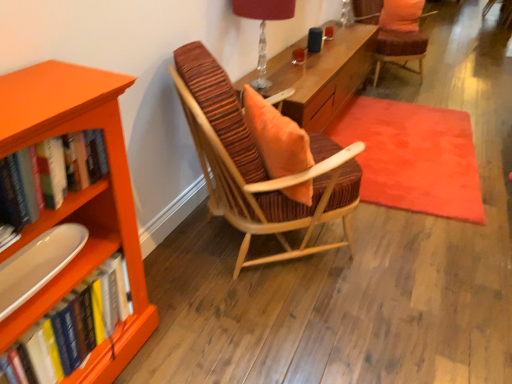
What is the approximate width of velvet orange cushioned chair at upper right, the second chair viewed from the front?

It is 31.78 inches.

What do you see at coordinates (395, 31) in the screenshot? The image size is (512, 384). I see `velvet orange cushioned chair at upper right, the second chair viewed from the front` at bounding box center [395, 31].

Identify the location of hardcover books at left, positioned as the 1th book in top-to-bottom order. The image size is (512, 384). (51, 173).

At what (x,y) coordinates should I click in order to perform the action: click on striped fabric chair at center, the 2th chair viewed from the back. Please return your answer as a coordinate pair (x, y). Looking at the image, I should click on (259, 164).

Describe the element at coordinates (81, 322) in the screenshot. This screenshot has height=384, width=512. I see `hardcover books at left, acting as the 1th book starting from the bottom` at that location.

Locate an element on the screen. translucent glass table lamp at upper center is located at coordinates (263, 27).

I want to click on velvet orange cushioned chair at upper right, arranged as the first chair when viewed from the back, so click(x=395, y=31).

Would you say striped fabric chair at center, which is the second chair in right-to-left order, is outside velvet orange cushioned chair at upper right, acting as the first chair starting from the right?

Indeed, striped fabric chair at center, which is the second chair in right-to-left order, is completely outside velvet orange cushioned chair at upper right, acting as the first chair starting from the right.

Considering the relative sizes of striped fabric chair at center, the first chair from the left, and velvet orange cushioned chair at upper right, arranged as the first chair when viewed from the back, in the image provided, is striped fabric chair at center, the first chair from the left, wider than velvet orange cushioned chair at upper right, arranged as the first chair when viewed from the back,?

Incorrect, the width of striped fabric chair at center, the first chair from the left, does not surpass that of velvet orange cushioned chair at upper right, arranged as the first chair when viewed from the back.

Considering the relative positions of striped fabric chair at center, the 1th chair positioned from the bottom, and velvet orange cushioned chair at upper right, acting as the first chair starting from the right, in the image provided, is striped fabric chair at center, the 1th chair positioned from the bottom, to the left of velvet orange cushioned chair at upper right, acting as the first chair starting from the right, from the viewer's perspective?

Yes.

From a real-world perspective, which object stands above the other?

striped fabric chair at center, the 1th chair positioned from the bottom, is physically above.

Which object is further away from the camera taking this photo, velvet orange rug at center or orange fabric pillow at upper right?

Positioned behind is orange fabric pillow at upper right.

Is velvet orange rug at center oriented towards orange fabric pillow at upper right?

No, velvet orange rug at center is not facing towards orange fabric pillow at upper right.

Does velvet orange rug at center appear on the left side of orange fabric pillow at upper right?

Yes, velvet orange rug at center is to the left of orange fabric pillow at upper right.

Identify the location of the 1st chair behind the hardcover books at left, the second book in the bottom-to-top sequence. (259, 164).

Considering the relative sizes of hardcover books at left, positioned as the 1th book in top-to-bottom order, and striped fabric chair at center, the first chair from the left, in the image provided, is hardcover books at left, positioned as the 1th book in top-to-bottom order, bigger than striped fabric chair at center, the first chair from the left,?

No.

Is hardcover books at left, positioned as the 1th book in top-to-bottom order, not close to striped fabric chair at center, the 1th chair positioned from the bottom?

That's not correct — hardcover books at left, positioned as the 1th book in top-to-bottom order, is a little close to striped fabric chair at center, the 1th chair positioned from the bottom.

Considering the relative positions of hardcover books at left, positioned as the 1th book in top-to-bottom order, and striped fabric chair at center, which appears as the 2th chair when viewed from the top, in the image provided, is hardcover books at left, positioned as the 1th book in top-to-bottom order, to the left of striped fabric chair at center, which appears as the 2th chair when viewed from the top, from the viewer's perspective?

Indeed, hardcover books at left, positioned as the 1th book in top-to-bottom order, is positioned on the left side of striped fabric chair at center, which appears as the 2th chair when viewed from the top.

Is matte white tray at lower left at the right side of orange fabric pillow at upper right?

No, matte white tray at lower left is not to the right of orange fabric pillow at upper right.

At what (x,y) coordinates should I click in order to perform the action: click on pillow behind the matte white tray at lower left. Please return your answer as a coordinate pair (x, y). Looking at the image, I should click on (401, 15).

Is matte white tray at lower left positioned in front of orange fabric pillow at upper right?

Yes, it is.

Is translucent glass table lamp at upper center to the right of hardcover books at left, acting as the 1th book starting from the bottom, from the viewer's perspective?

Indeed, translucent glass table lamp at upper center is positioned on the right side of hardcover books at left, acting as the 1th book starting from the bottom.

Does translucent glass table lamp at upper center turn towards hardcover books at left, which ranks as the 2th book in top-to-bottom order?

No, translucent glass table lamp at upper center is not aimed at hardcover books at left, which ranks as the 2th book in top-to-bottom order.

Which object is closer to the camera taking this photo, translucent glass table lamp at upper center or hardcover books at left, acting as the 1th book starting from the bottom?

hardcover books at left, acting as the 1th book starting from the bottom, is in front.

Is translucent glass table lamp at upper center not near hardcover books at left, acting as the 1th book starting from the bottom?

Yes.

How distant is striped fabric chair at center, the 1th chair positioned from the bottom, from orange matte bookcase at left?

striped fabric chair at center, the 1th chair positioned from the bottom, and orange matte bookcase at left are 21.52 inches apart.

Would you say striped fabric chair at center, which is the second chair in right-to-left order, is outside orange matte bookcase at left?

striped fabric chair at center, which is the second chair in right-to-left order, lies outside orange matte bookcase at left's area.

From a real-world perspective, is striped fabric chair at center, the 2th chair viewed from the back, physically located above or below orange matte bookcase at left?

striped fabric chair at center, the 2th chair viewed from the back, is situated higher than orange matte bookcase at left in the real world.

Does point (241, 191) come in front of point (99, 91)?

No, it is behind (99, 91).

Is orange matte bookcase at left at the back of velvet orange rug at center?

No, velvet orange rug at center is not facing the opposite direction of orange matte bookcase at left.

Considering the points (444, 201) and (70, 70), which point is in front, point (444, 201) or point (70, 70)?

The point (70, 70) is in front.

Is velvet orange rug at center behind orange matte bookcase at left?

Yes.

This screenshot has width=512, height=384. Identify the location of chair below the striped fabric chair at center, which is the second chair in right-to-left order (from a real-world perspective). (395, 31).

You are a GUI agent. You are given a task and a screenshot of the screen. Output one action in this format:
    pyautogui.click(x=<x>, y=<y>)
    Task: Click on the pillow behind the velvet orange rug at center
    This screenshot has width=512, height=384.
    Given the screenshot: What is the action you would take?
    pyautogui.click(x=401, y=15)

Looking at this image, estimate the real-world distances between objects in this image. Which object is further from orange fabric pillow at upper right, orange matte bookcase at left or velvet orange rug at center?

orange matte bookcase at left.

Based on their spatial positions, is hardcover books at left, which ranks as the 2th book in top-to-bottom order, or striped fabric chair at center, the first chair from the left, closer to velvet orange cushioned chair at upper right, arranged as the first chair when viewed from the back?

Based on the image, striped fabric chair at center, the first chair from the left, appears to be nearer to velvet orange cushioned chair at upper right, arranged as the first chair when viewed from the back.

Based on their spatial positions, is hardcover books at left, positioned as the 1th book in top-to-bottom order, or translucent glass table lamp at upper center closer to velvet orange cushioned chair at upper right, arranged as the 1th chair when viewed from the top?

Among the two, translucent glass table lamp at upper center is located nearer to velvet orange cushioned chair at upper right, arranged as the 1th chair when viewed from the top.

Consider the image. Estimate the real-world distances between objects in this image. Which object is closer to translucent glass table lamp at upper center, striped fabric chair at center, which appears as the 2th chair when viewed from the top, or orange fabric pillow at upper right?

The object closer to translucent glass table lamp at upper center is striped fabric chair at center, which appears as the 2th chair when viewed from the top.

From the image, which object appears to be farther from orange matte bookcase at left, matte white tray at lower left or orange fabric pillow at upper right?

Among the two, orange fabric pillow at upper right is located further to orange matte bookcase at left.

Estimate the real-world distances between objects in this image. Which object is further from velvet orange cushioned chair at upper right, the second chair viewed from the front, velvet orange rug at center or striped fabric chair at center, the 1th chair in the front-to-back sequence?

Based on the image, striped fabric chair at center, the 1th chair in the front-to-back sequence, appears to be further to velvet orange cushioned chair at upper right, the second chair viewed from the front.

Considering their positions, is velvet orange cushioned chair at upper right, which is the 2th chair from left to right, positioned further to hardcover books at left, acting as the 1th book starting from the bottom, than translucent glass table lamp at upper center?

velvet orange cushioned chair at upper right, which is the 2th chair from left to right, lies further to hardcover books at left, acting as the 1th book starting from the bottom, than the other object.

Estimate the real-world distances between objects in this image. Which object is further from orange matte bookcase at left, hardcover books at left, the second book in the bottom-to-top sequence, or velvet orange cushioned chair at upper right, acting as the first chair starting from the right?

The object further to orange matte bookcase at left is velvet orange cushioned chair at upper right, acting as the first chair starting from the right.

Locate an element on the screen. table lamp between matte white tray at lower left and orange fabric pillow at upper right in the front-back direction is located at coordinates (263, 27).

Locate an element on the screen. The image size is (512, 384). chair situated between translucent glass table lamp at upper center and velvet orange rug at center from left to right is located at coordinates (259, 164).

Identify the location of book between matte white tray at lower left and orange fabric pillow at upper right from front to back. This screenshot has width=512, height=384. (81, 322).

Find the location of `mat between orange matte bookcase at left and orange fabric pillow at upper right in the front-back direction`. mat between orange matte bookcase at left and orange fabric pillow at upper right in the front-back direction is located at coordinates (414, 157).